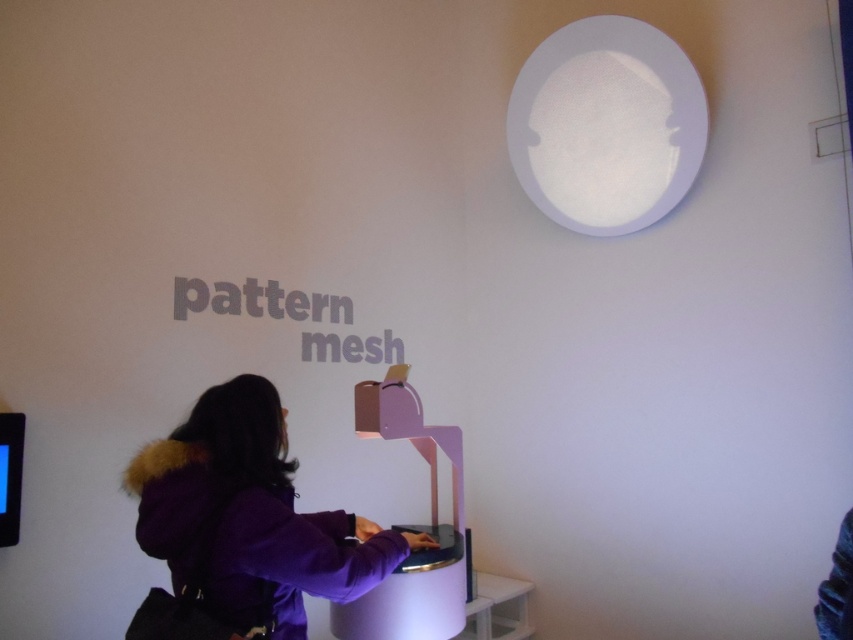
Looking at this image, between purple fabric coat at center and dark purple fabric at lower right, which one has more height?

purple fabric coat at center is taller.

What do you see at coordinates (244, 525) in the screenshot? I see `purple fabric coat at center` at bounding box center [244, 525].

Where is `purple fabric coat at center`? This screenshot has height=640, width=853. purple fabric coat at center is located at coordinates (244, 525).

Is purple fabric coat at center further to the viewer compared to white plastic stool at lower center?

No, purple fabric coat at center is in front of white plastic stool at lower center.

Does point (136, 522) come behind point (492, 582)?

That is False.

Between point (215, 582) and point (521, 612), which one is positioned behind?

Positioned behind is point (521, 612).

You are a GUI agent. You are given a task and a screenshot of the screen. Output one action in this format:
    pyautogui.click(x=<x>, y=<y>)
    Task: Click on the purple fabric coat at center
    Image resolution: width=853 pixels, height=640 pixels.
    Given the screenshot: What is the action you would take?
    pyautogui.click(x=244, y=525)

Is point (476, 579) behind point (849, 536)?

Yes, point (476, 579) is farther from viewer.

Which is behind, point (502, 602) or point (851, 589)?

Positioned behind is point (502, 602).

This screenshot has width=853, height=640. Describe the element at coordinates (497, 609) in the screenshot. I see `white plastic stool at lower center` at that location.

Where is `white plastic stool at lower center`? white plastic stool at lower center is located at coordinates (497, 609).